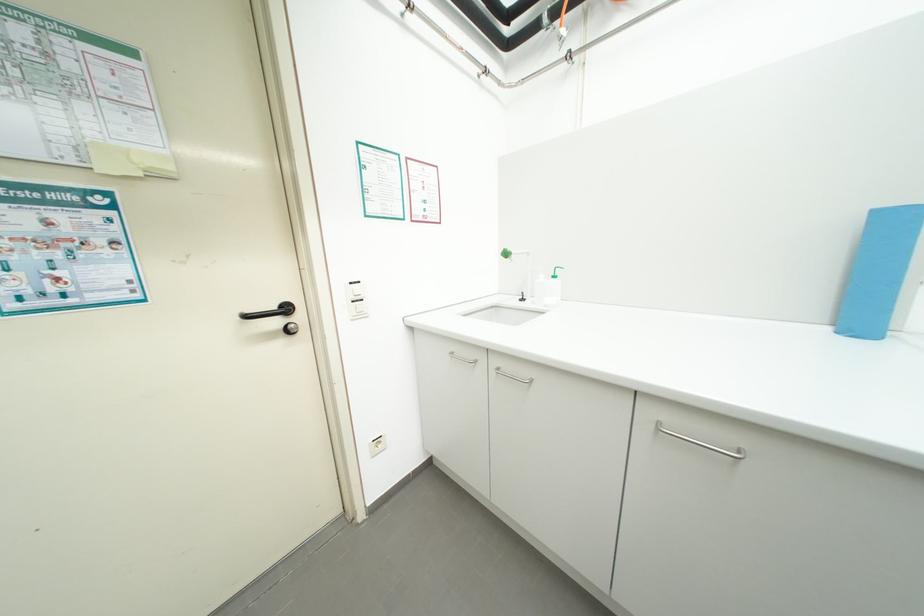
The location [879,270] corresponds to which object?

It refers to a blue paper roll.